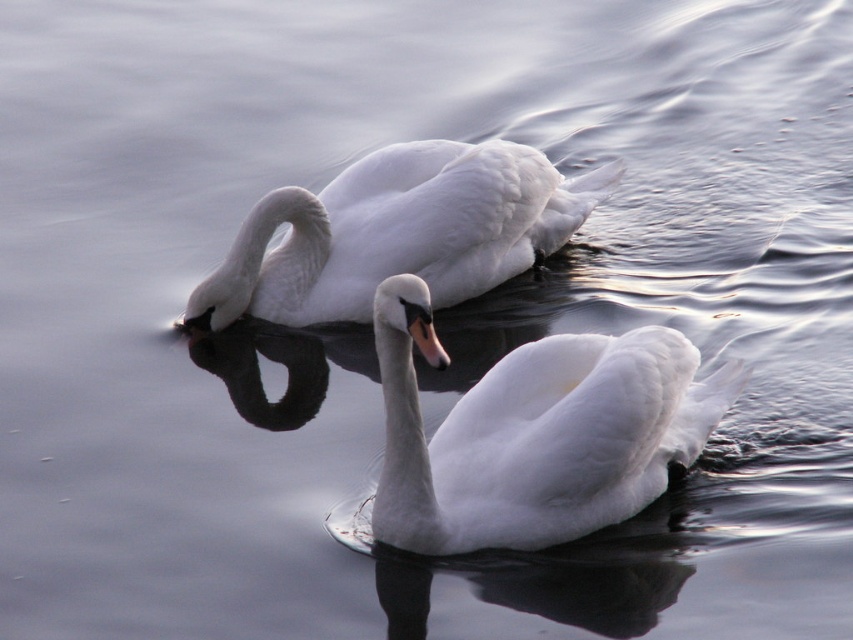
Looking at this image, you are a wildlife photographer aiming to capture a closeup shot of the white glossy swan at center. Given that your camera has a focal length of 300mm and you are positioned at point A, which is at coordinates 0.5, 0.5, can you determine if the swan is within your camera frame?

The white glossy swan at center is located at point (534, 433). Since your position is at (426, 320), the swan is slightly to the right and above your current viewpoint. Depending on the camera angle and zoom, it might be within the frame, but precise adjustments may be needed for a clear closeup.